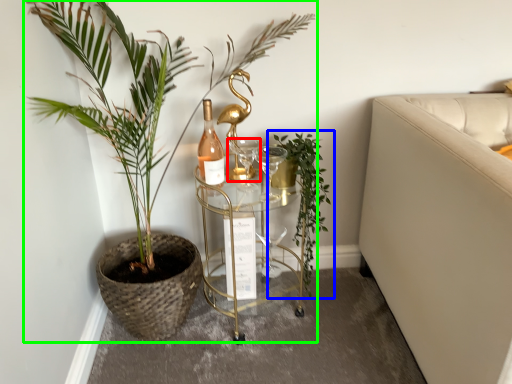
Question: Based on their relative distances, which object is farther from wine glass (highlighted by a red box)? Choose from houseplant (highlighted by a blue box) and houseplant (highlighted by a green box).

Choices:
 (A) houseplant
 (B) houseplant

Answer: (B)